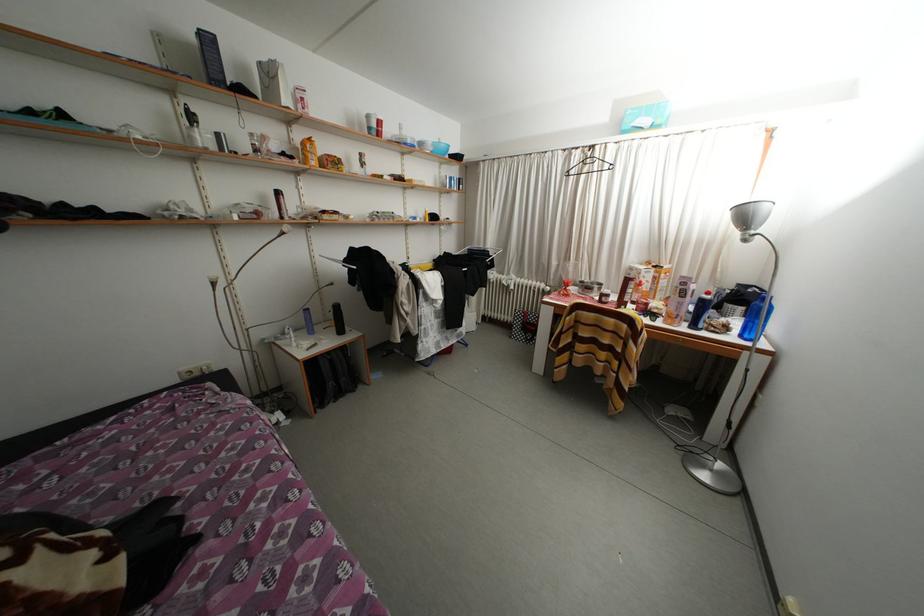
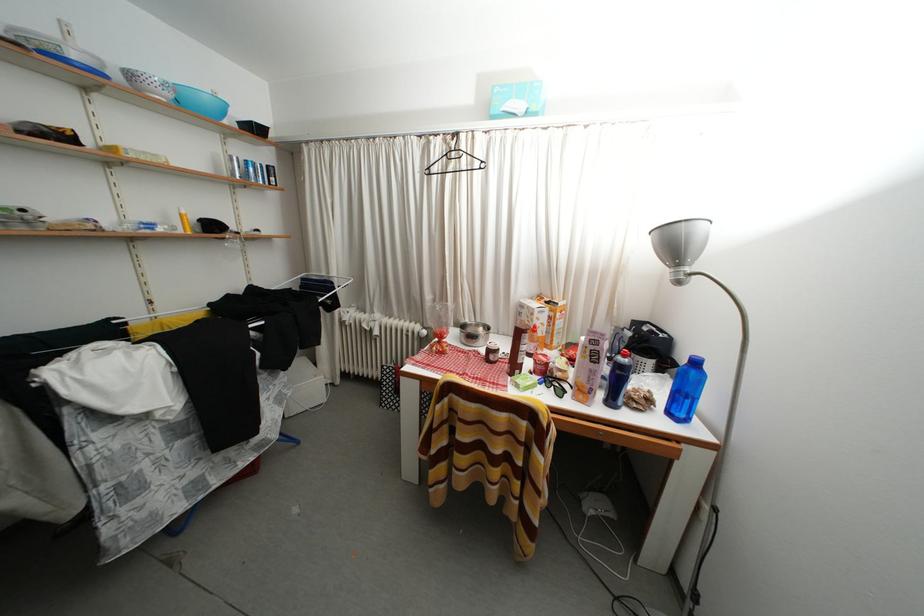
Where in the second image is the point corresponding to pixel 700 331 from the first image?

(618, 408)